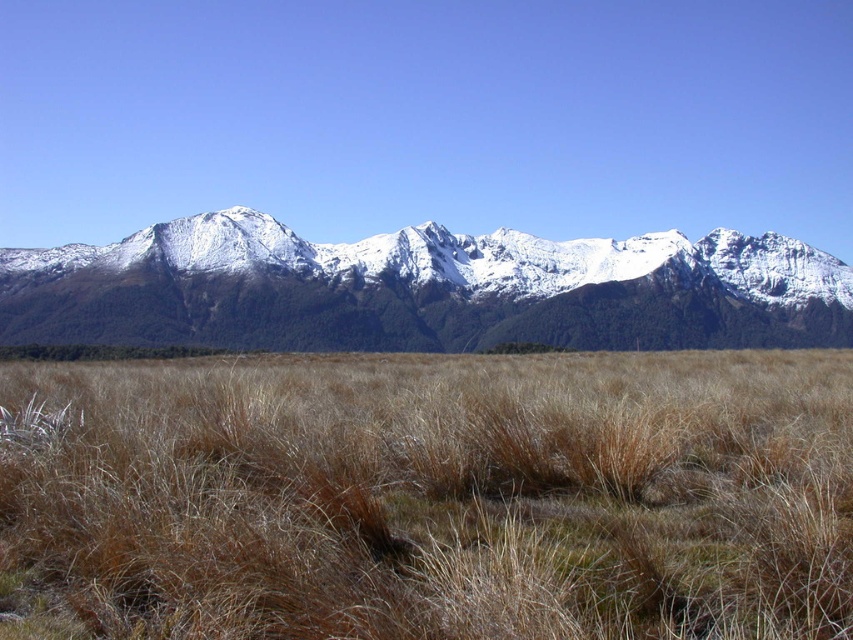
Is the position of brown dry grass at center less distant than that of white snow-covered mountain range at center?

Yes, brown dry grass at center is closer to the viewer.

Is point (19, 442) more distant than point (267, 307)?

No, it is not.

I want to click on brown dry grass at center, so click(x=430, y=497).